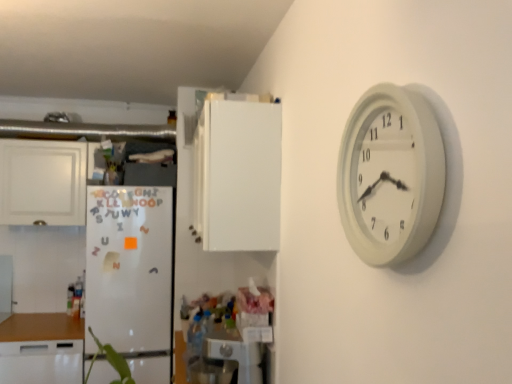
Question: Considering the relative sizes of white matte refrigerator at left and white matte cabinet at left, the 1th cabinetry in the left-to-right sequence, in the image provided, is white matte refrigerator at left shorter than white matte cabinet at left, the 1th cabinetry in the left-to-right sequence,?

Choices:
 (A) no
 (B) yes

Answer: (A)

Question: Is white matte refrigerator at left turned away from white matte cabinet at left, the 1th cabinetry in the left-to-right sequence?

Choices:
 (A) no
 (B) yes

Answer: (A)

Question: From a real-world perspective, does white matte refrigerator at left sit lower than white matte cabinet at left, the 1th cabinetry in the left-to-right sequence?

Choices:
 (A) yes
 (B) no

Answer: (A)

Question: Is white matte refrigerator at left not near white matte cabinet at left, the 2th cabinetry in the right-to-left sequence?

Choices:
 (A) yes
 (B) no

Answer: (B)

Question: Is white matte refrigerator at left to the right of white matte cabinet at left, the 1th cabinetry in the left-to-right sequence, from the viewer's perspective?

Choices:
 (A) no
 (B) yes

Answer: (B)

Question: From a real-world perspective, relative to white matte refrigerator at left, is metallic silver appliance at lower center vertically above or below?

Choices:
 (A) above
 (B) below

Answer: (B)

Question: Is metallic silver appliance at lower center inside the boundaries of white matte refrigerator at left, or outside?

Choices:
 (A) inside
 (B) outside

Answer: (B)

Question: Is metallic silver appliance at lower center taller or shorter than white matte refrigerator at left?

Choices:
 (A) short
 (B) tall

Answer: (A)

Question: In the image, is metallic silver appliance at lower center on the left side or the right side of white matte refrigerator at left?

Choices:
 (A) right
 (B) left

Answer: (A)

Question: Considering the positions of white matte refrigerator at left and white matte cabinet at left, the 2th cabinetry in the right-to-left sequence, in the image, is white matte refrigerator at left taller or shorter than white matte cabinet at left, the 2th cabinetry in the right-to-left sequence,?

Choices:
 (A) short
 (B) tall

Answer: (B)

Question: Does point (97, 307) appear closer or farther from the camera than point (83, 200)?

Choices:
 (A) closer
 (B) farther

Answer: (A)

Question: Looking at their shapes, would you say white matte refrigerator at left is wider or thinner than white matte cabinet at left, marked as the 2th cabinetry in a front-to-back arrangement?

Choices:
 (A) wide
 (B) thin

Answer: (A)

Question: Is white matte refrigerator at left in front of or behind white matte cabinet at left, which is the first cabinetry from back to front, in the image?

Choices:
 (A) front
 (B) behind

Answer: (A)

Question: Considering the positions of white matte cabinet at center, arranged as the first cabinetry when viewed from the front, and white matte refrigerator at left in the image, is white matte cabinet at center, arranged as the first cabinetry when viewed from the front, taller or shorter than white matte refrigerator at left?

Choices:
 (A) tall
 (B) short

Answer: (B)

Question: Considering the positions of white matte cabinet at center, arranged as the first cabinetry when viewed from the front, and white matte refrigerator at left in the image, is white matte cabinet at center, arranged as the first cabinetry when viewed from the front, bigger or smaller than white matte refrigerator at left?

Choices:
 (A) big
 (B) small

Answer: (B)